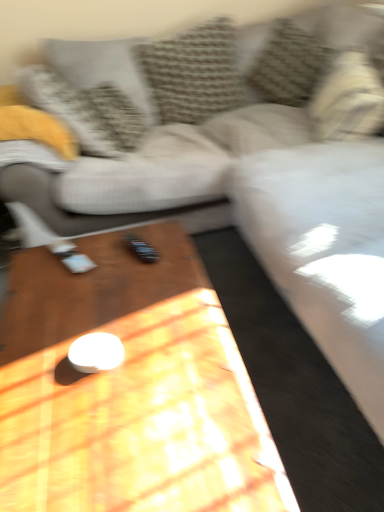
Question: From the image's perspective, is wooden coffee table at center positioned above or below textured gray pillow at upper left, the 5th pillow when ordered from right to left?

Choices:
 (A) below
 (B) above

Answer: (A)

Question: Looking at the image, does wooden coffee table at center seem bigger or smaller compared to textured gray pillow at upper left, placed as the 1th pillow when sorted from left to right?

Choices:
 (A) small
 (B) big

Answer: (B)

Question: Based on their relative distances, which object is nearer to the textured gray pillow at upper left, positioned as the second pillow in left-to-right order?

Choices:
 (A) textured gray pillow at upper center, which is the 4th pillow in left-to-right order
 (B) beige textured pillow at upper right, which is counted as the first pillow, starting from the right
 (C) textured gray pillow at upper left, the 5th pillow when ordered from right to left
 (D) textured beige pillow at upper center, which ranks as the third pillow in left-to-right order
 (E) wooden coffee table at center

Answer: (C)

Question: Estimate the real-world distances between objects in this image. Which object is farther from the textured gray pillow at upper center, which is the 4th pillow in left-to-right order?

Choices:
 (A) textured beige pillow at upper center, the 3th pillow in the right-to-left sequence
 (B) textured gray pillow at upper left, positioned as the second pillow in left-to-right order
 (C) beige textured pillow at upper right, which is counted as the first pillow, starting from the right
 (D) wooden coffee table at center
 (E) textured gray pillow at upper left, the 5th pillow when ordered from right to left

Answer: (D)